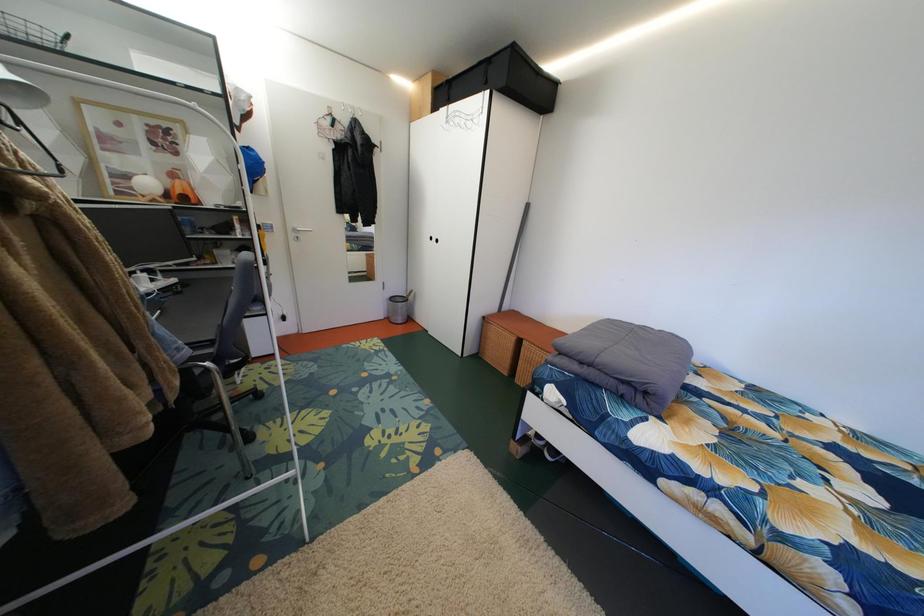
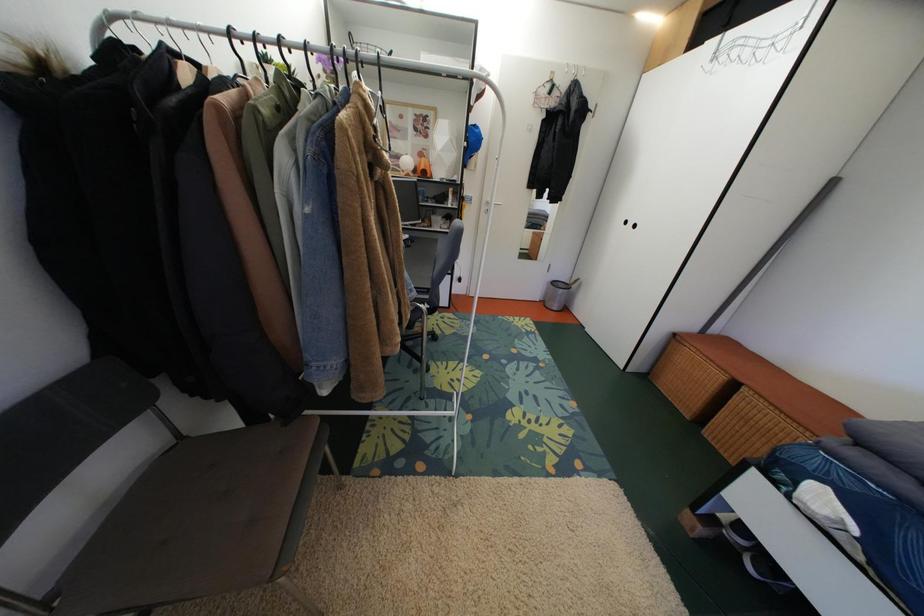
Question: The camera is either moving clockwise (left) or counter-clockwise (right) around the object. The first image is from the beginning of the video and the second image is from the end. Is the camera moving left or right when shooting the video?

Choices:
 (A) Left
 (B) Right

Answer: (B)